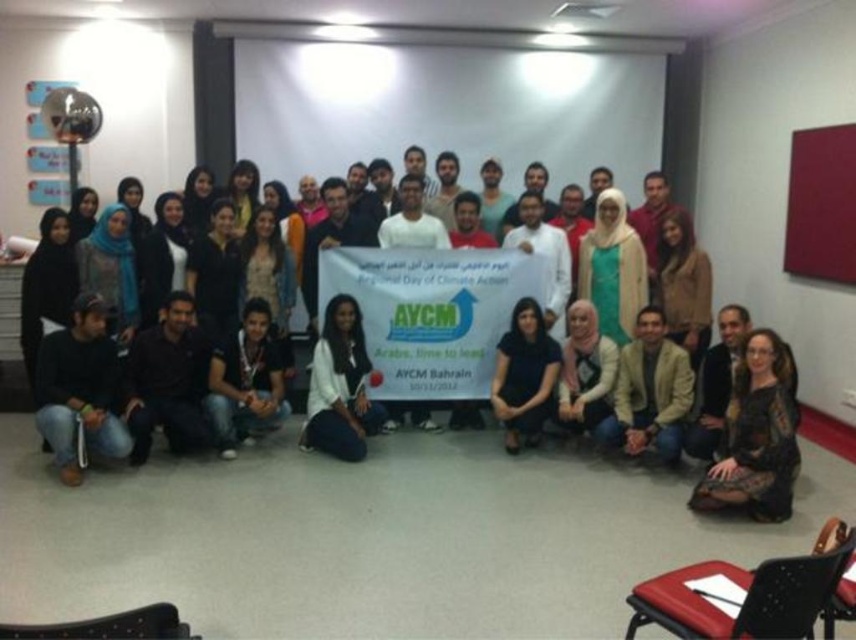
Is black lace dress at lower right thinner than beige fabric jacket at lower center?

Yes.

Is black lace dress at lower right in front of beige fabric jacket at lower center?

Yes, black lace dress at lower right is closer to the viewer.

Does point (782, 508) come closer to viewer compared to point (616, 442)?

Yes, point (782, 508) is closer to viewer.

Find the location of `black lace dress at lower right`. black lace dress at lower right is located at coordinates (756, 435).

Is point (752, 420) in front of point (495, 353)?

Yes.

Who is positioned more to the left, black lace dress at lower right or black fabric shirt at lower center?

From the viewer's perspective, black fabric shirt at lower center appears more on the left side.

Between point (771, 360) and point (513, 349), which one is positioned in front?

Point (771, 360)

Locate an element on the screen. The image size is (856, 640). black lace dress at lower right is located at coordinates (756, 435).

Between white matte shirt at center and black fabric shirt at lower center, which one has more height?

white matte shirt at center

Between point (310, 444) and point (516, 410), which one is positioned behind?

Positioned behind is point (310, 444).

This screenshot has height=640, width=856. Find the location of `white matte shirt at center`. white matte shirt at center is located at coordinates (340, 387).

You are a GUI agent. You are given a task and a screenshot of the screen. Output one action in this format:
    pyautogui.click(x=<x>, y=<y>)
    Task: Click on the white matte shirt at center
    The width and height of the screenshot is (856, 640).
    Given the screenshot: What is the action you would take?
    340,387